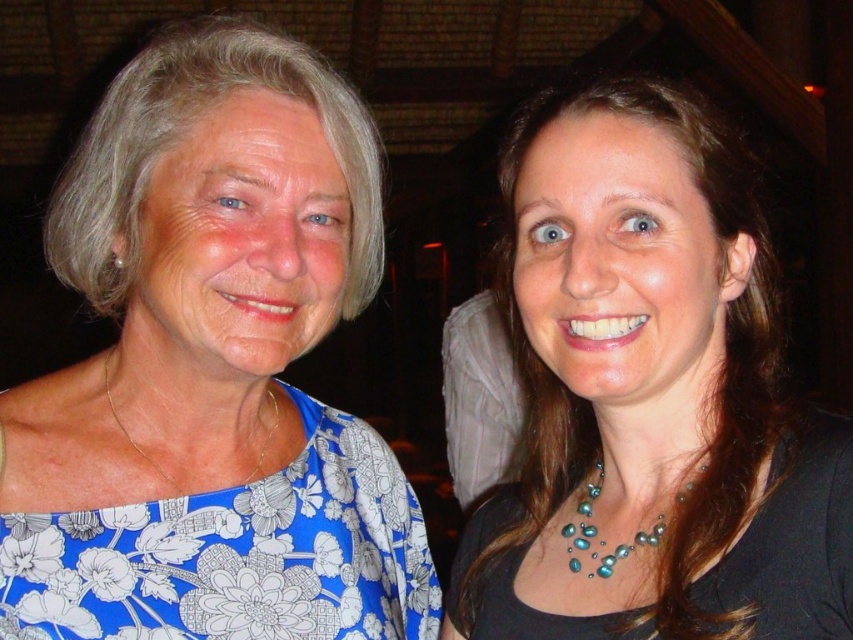
Question: Is blue floral dress at center positioned before black matte necklace at upper center?

Choices:
 (A) yes
 (B) no

Answer: (B)

Question: Is teal pearl necklace at center thinner than gold chain necklace at left?

Choices:
 (A) no
 (B) yes

Answer: (A)

Question: Which point is closer to the camera taking this photo?

Choices:
 (A) (326, 428)
 (B) (169, 477)
 (C) (579, 536)

Answer: (C)

Question: Which of the following is the closest to the observer?

Choices:
 (A) teal pearl necklace at center
 (B) pearl-like beads at center
 (C) black matte necklace at upper center

Answer: (C)

Question: Can you confirm if teal pearl necklace at center is positioned to the left of gold chain necklace at left?

Choices:
 (A) yes
 (B) no

Answer: (B)

Question: Which object appears closest to the camera in this image?

Choices:
 (A) teal pearl necklace at center
 (B) blue floral dress at center
 (C) pearl-like beads at center

Answer: (A)